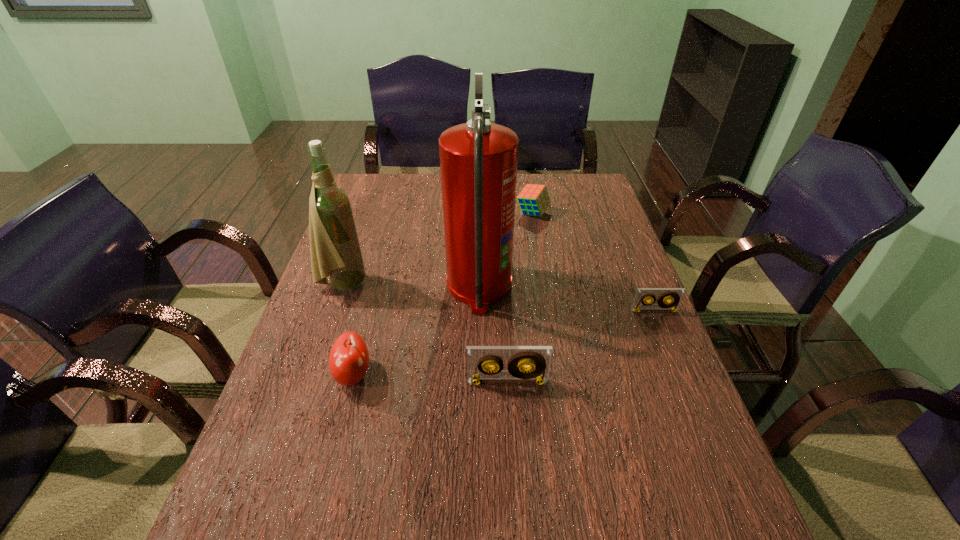
In the image, there is a desktop. At what (x,y) coordinates should I click in order to perform the action: click on vacant space at the left edge. Please return your answer as a coordinate pair (x, y). Looking at the image, I should click on (336, 423).

Find the location of a particular element. free space at the right edge is located at coordinates (629, 251).

Identify the location of free space at the far left corner of the desktop. (373, 175).

This screenshot has width=960, height=540. In order to click on free space at the near right corner in this screenshot , I will do `click(703, 490)`.

Identify the location of vacant space in between the tallest object and the apple. (417, 330).

Locate an element on the screen. This screenshot has width=960, height=540. vacant point located between the taller videotape and the fire extinguisher is located at coordinates (493, 334).

The image size is (960, 540). Identify the location of blank region between the taller videotape and the apple. (430, 378).

Where is `free space between the fire extinguisher and the rightmost object`? The height and width of the screenshot is (540, 960). free space between the fire extinguisher and the rightmost object is located at coordinates (566, 299).

I want to click on free space between the fifth shortest object and the tallest object, so click(411, 286).

This screenshot has height=540, width=960. I want to click on free space that is in between the rightmost object and the taller videotape, so click(581, 346).